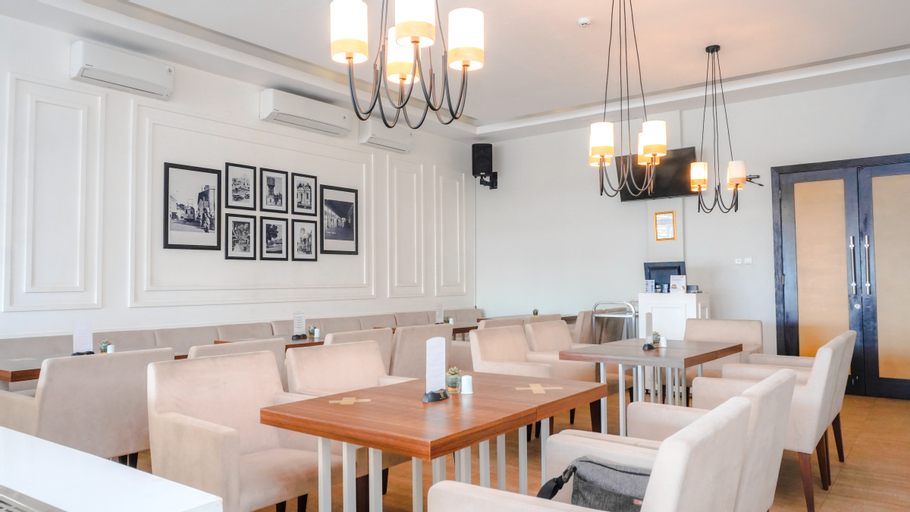
Identify the location of white shaker on tables. This screenshot has height=512, width=910. (469, 383), (662, 344), (449, 320), (318, 331), (108, 349).